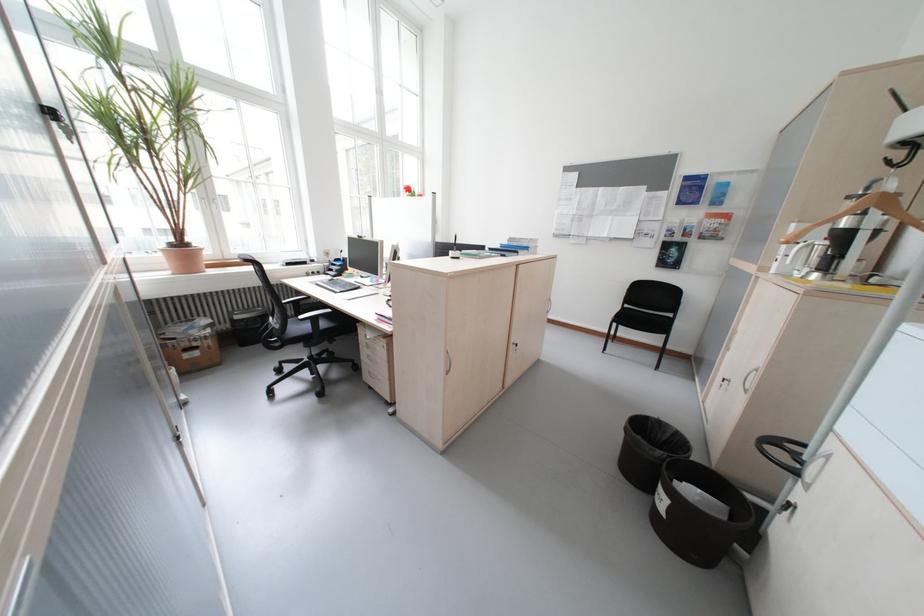
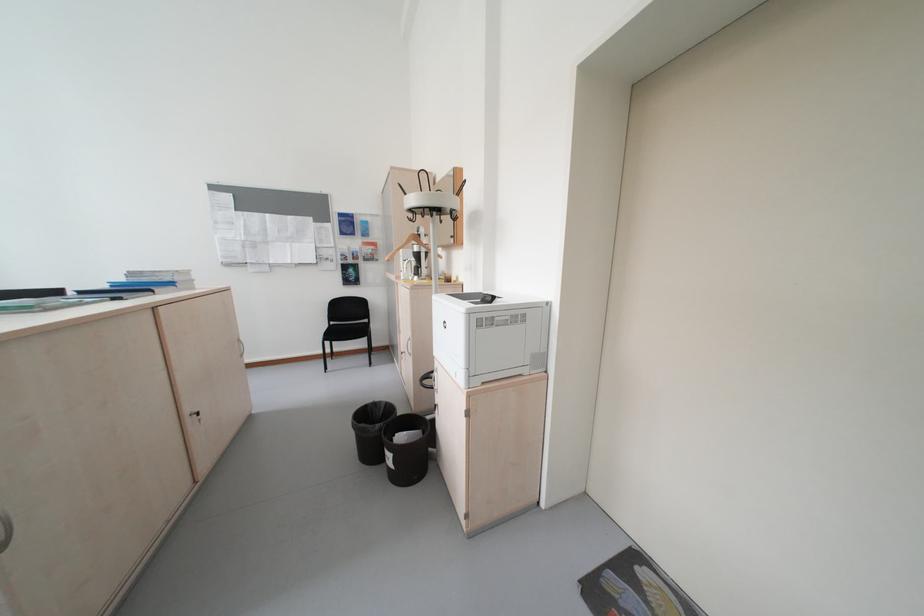
The point at (523, 347) is marked in the first image. Where is the corresponding point in the second image?

(200, 421)